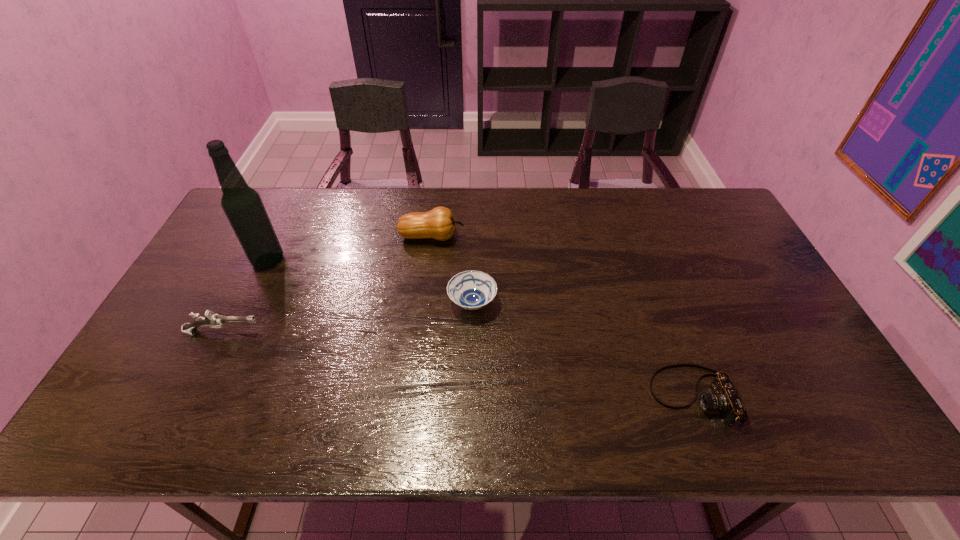
Where is `free region that satisfies the following two spatial constraints: 1. on the stem side of the gourd; 2. on the left side of the soup bowl`? The image size is (960, 540). free region that satisfies the following two spatial constraints: 1. on the stem side of the gourd; 2. on the left side of the soup bowl is located at coordinates (424, 303).